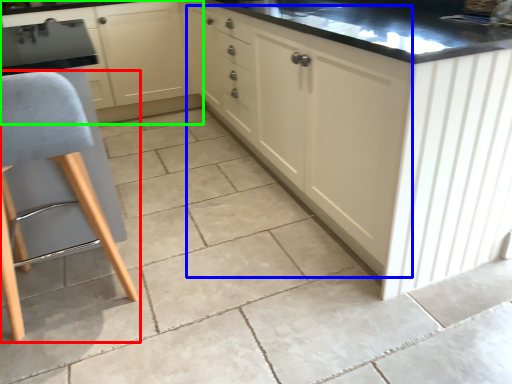
Question: Estimate the real-world distances between objects in this image. Which object is farther from furniture (highlighted by a red box), cabinetry (highlighted by a blue box) or cabinetry (highlighted by a green box)?

Choices:
 (A) cabinetry
 (B) cabinetry

Answer: (B)